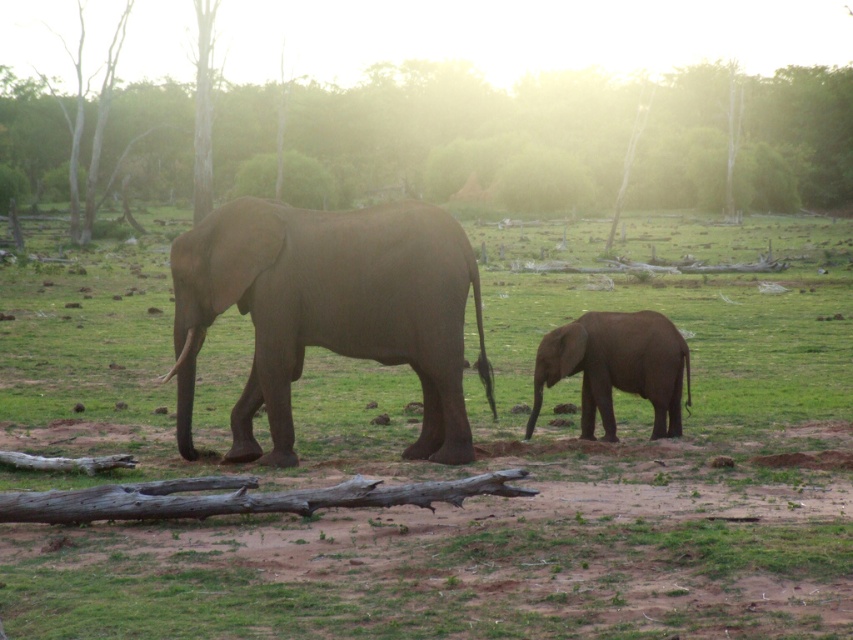
Does point (515, 556) lie behind point (606, 6)?

No, (515, 556) is closer to viewer.

Who is higher up, brown matte elephant at center or brown textured tree at upper center?

brown textured tree at upper center is above.

Between point (709, 481) and point (527, 29), which one is positioned in front?

Point (709, 481) is in front.

The height and width of the screenshot is (640, 853). Find the location of `brown matte elephant at center`. brown matte elephant at center is located at coordinates (456, 470).

Can you confirm if gray matte elephant at center is thinner than gray matte elephant at lower right?

No.

Can you confirm if gray matte elephant at center is positioned below gray matte elephant at lower right?

No.

Which is in front, point (312, 248) or point (606, 396)?

Point (312, 248) is more forward.

The image size is (853, 640). I want to click on gray matte elephant at center, so point(329,310).

Does brown textured tree at upper center appear on the right side of gray matte elephant at lower right?

Incorrect, brown textured tree at upper center is not on the right side of gray matte elephant at lower right.

Does brown textured tree at upper center appear under gray matte elephant at lower right?

No.

Image resolution: width=853 pixels, height=640 pixels. Find the location of `brown textured tree at upper center`. brown textured tree at upper center is located at coordinates (525, 35).